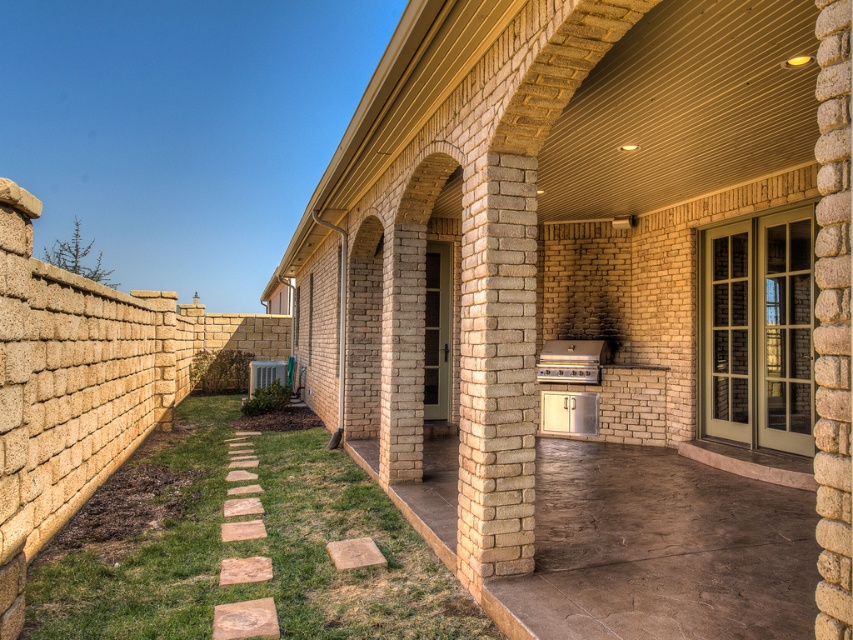
Question: Among these objects, which one is nearest to the camera?

Choices:
 (A) satin silver grill at center
 (B) matte stainless steel grill at center
 (C) matte brick grill at center

Answer: (C)

Question: Where is matte brick grill at center located in relation to satin silver grill at center in the image?

Choices:
 (A) above
 (B) below

Answer: (A)

Question: Does matte brick grill at center come in front of matte stainless steel grill at center?

Choices:
 (A) yes
 (B) no

Answer: (A)

Question: Which of these objects is positioned farthest from the matte brick grill at center?

Choices:
 (A) matte stainless steel grill at center
 (B) satin silver grill at center

Answer: (B)

Question: Estimate the real-world distances between objects in this image. Which object is farther from the matte stainless steel grill at center?

Choices:
 (A) matte brick grill at center
 (B) satin silver grill at center

Answer: (A)

Question: Is matte brick grill at center wider than matte stainless steel grill at center?

Choices:
 (A) no
 (B) yes

Answer: (B)